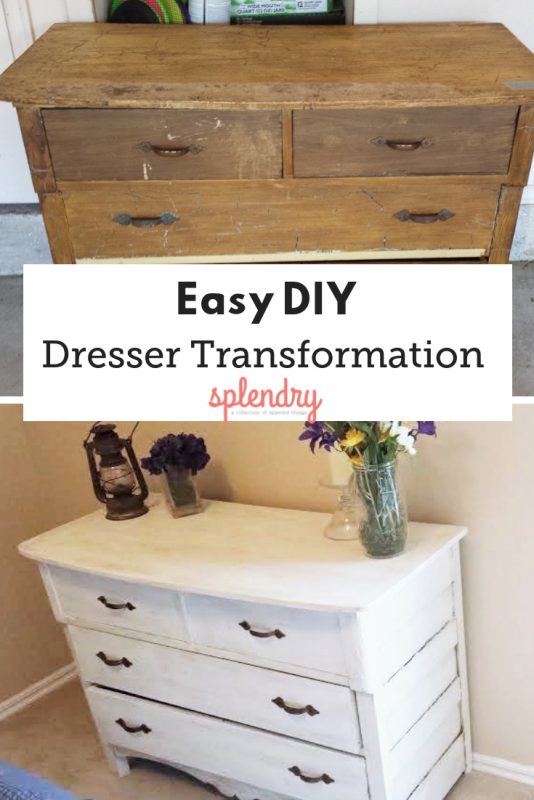
This screenshot has height=800, width=534. In order to click on skirting board in this screenshot , I will do `click(37, 686)`, `click(506, 762)`.